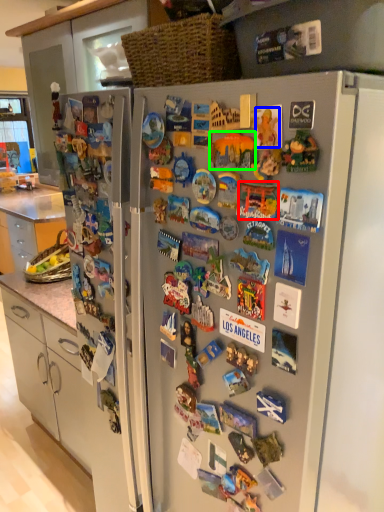
Question: Estimate the real-world distances between objects in this image. Which object is farther from toy (highlighted by a red box), toy (highlighted by a blue box) or toy (highlighted by a green box)?

Choices:
 (A) toy
 (B) toy

Answer: (A)